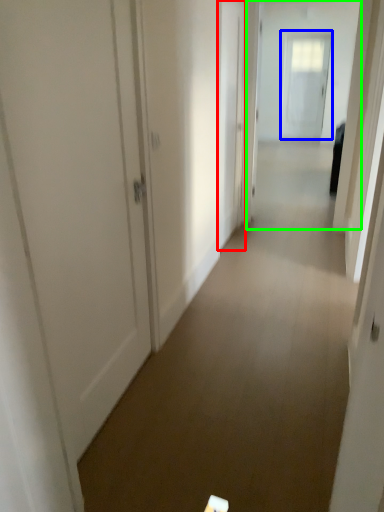
Question: Based on their relative distances, which object is nearer to door (highlighted by a red box)? Choose from door (highlighted by a blue box) and passage (highlighted by a green box).

Choices:
 (A) door
 (B) passage

Answer: (B)